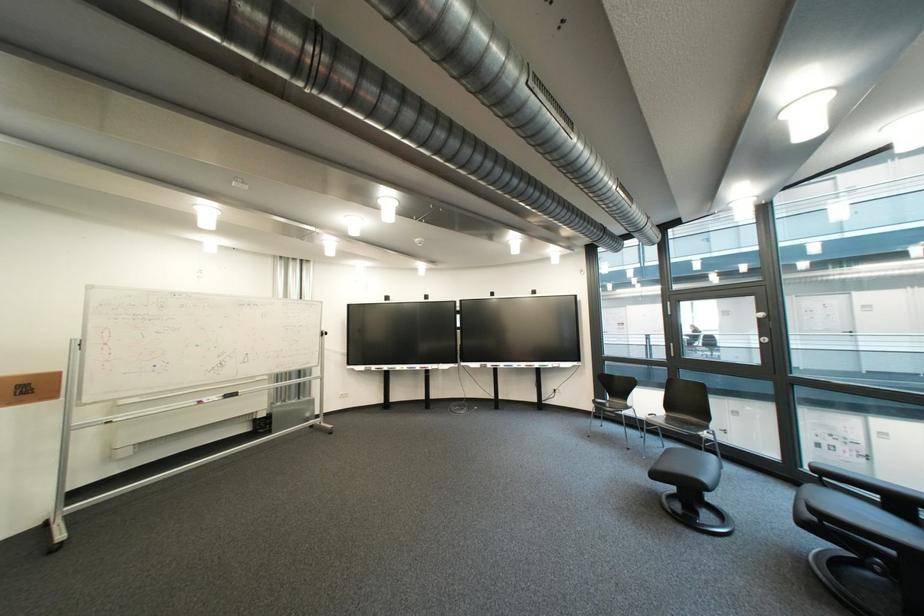
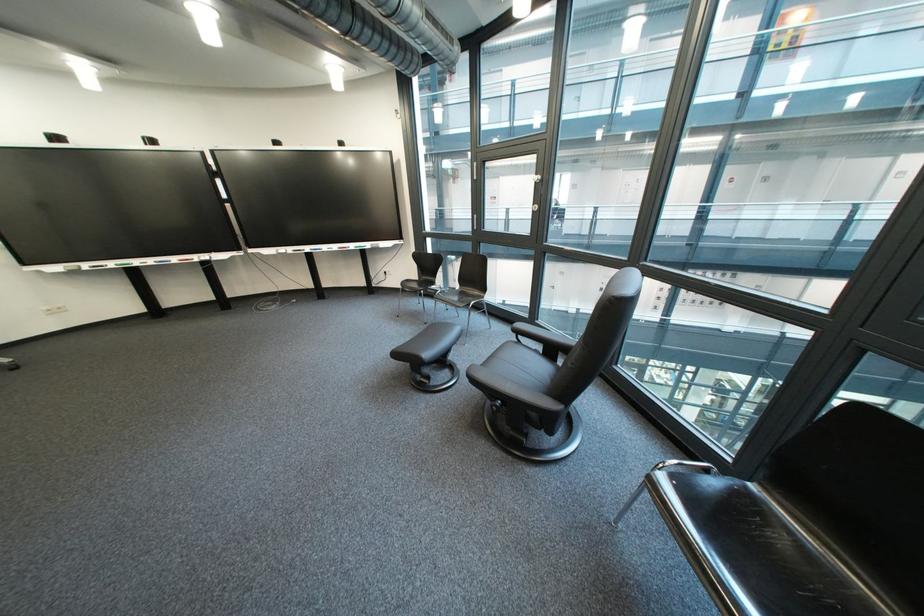
The point at (431,369) is marked in the first image. Where is the corresponding point in the second image?

(188, 261)